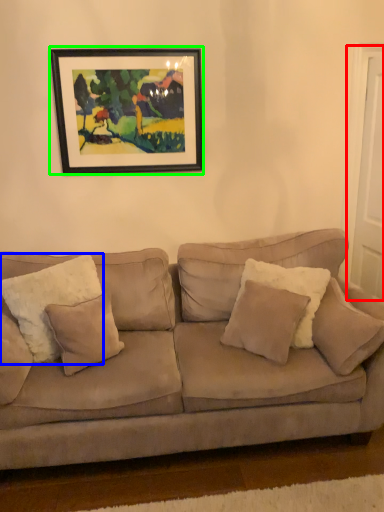
Question: Considering the real-world distances, which object is closest to door (highlighted by a red box)? pillow (highlighted by a blue box) or picture frame (highlighted by a green box).

Choices:
 (A) pillow
 (B) picture frame

Answer: (B)